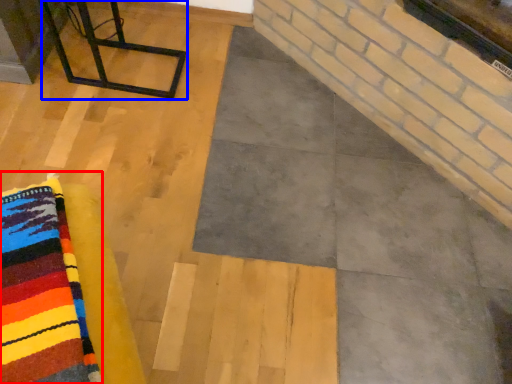
Question: Which of the following is the closest to the observer, cloth (highlighted by a red box) or furniture (highlighted by a blue box)?

Choices:
 (A) cloth
 (B) furniture

Answer: (A)